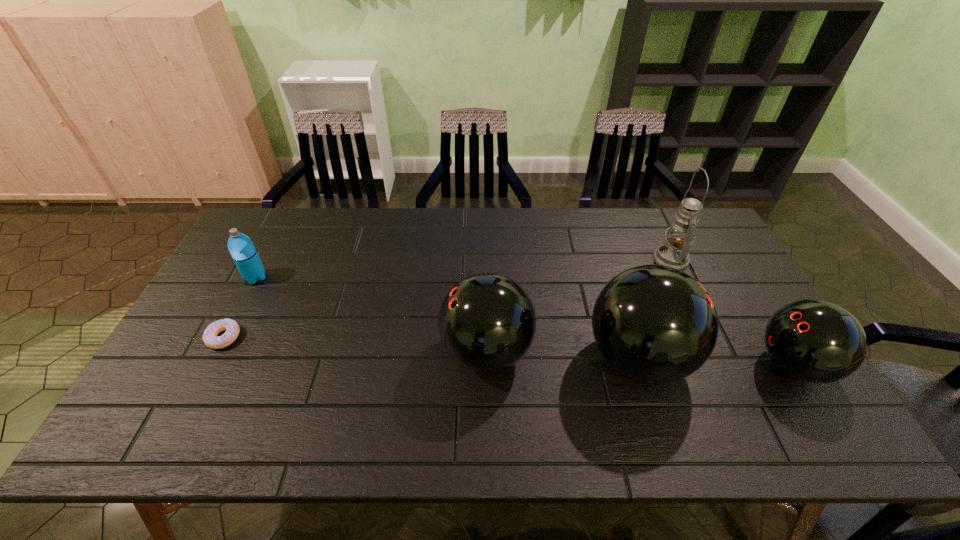
Identify the location of free space that satisfies the following two spatial constraints: 1. on the back side of the shortest object; 2. on the left side of the oil lamp. (265, 259).

Find the location of a particular element. The height and width of the screenshot is (540, 960). free space that satisfies the following two spatial constraints: 1. on the front side of the oil lamp; 2. on the surface of the third object from right to left near the finger holes is located at coordinates (717, 359).

Image resolution: width=960 pixels, height=540 pixels. In order to click on free space in the image that satisfies the following two spatial constraints: 1. on the back side of the oil lamp; 2. on the right side of the thermos bottle in this screenshot , I will do `click(265, 259)`.

Image resolution: width=960 pixels, height=540 pixels. I want to click on free space in the image that satisfies the following two spatial constraints: 1. on the back side of the shortest object; 2. on the right side of the thermos bottle, so click(x=255, y=278).

In order to click on free space that satisfies the following two spatial constraints: 1. on the front side of the oil lamp; 2. on the surface of the fourth object from left to right near the finger holes in this screenshot , I will do `click(717, 359)`.